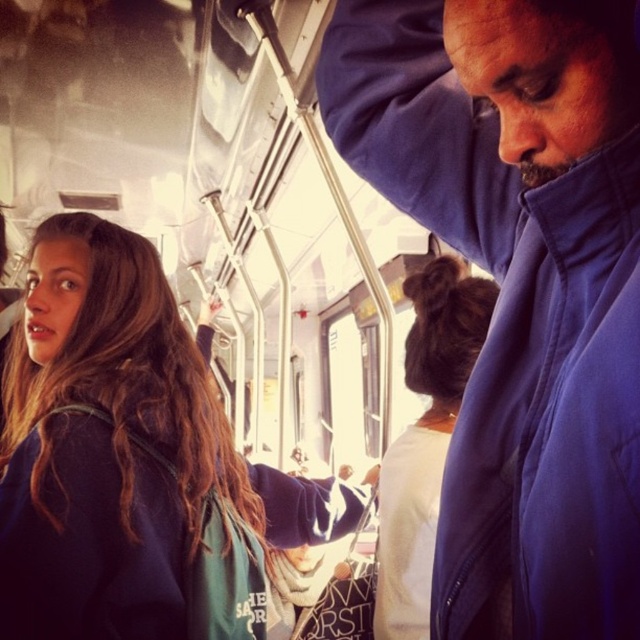
Question: Which point is closer to the camera?

Choices:
 (A) brown fuzzy hair at upper center
 (B) blue fleece jacket at upper right
 (C) brown hair at upper left

Answer: (B)

Question: Based on their relative distances, which object is nearer to the brown hair at upper left?

Choices:
 (A) brown fuzzy hair at upper center
 (B) blue fleece jacket at upper right

Answer: (A)

Question: Considering the relative positions of blue fleece jacket at upper right and brown hair at upper left in the image provided, where is blue fleece jacket at upper right located with respect to brown hair at upper left?

Choices:
 (A) below
 (B) above

Answer: (B)

Question: Can you confirm if blue fleece jacket at upper right is positioned to the left of brown hair at upper left?

Choices:
 (A) no
 (B) yes

Answer: (A)

Question: Which point appears closest to the camera in this image?

Choices:
 (A) (422, 416)
 (B) (93, 259)
 (C) (561, 236)

Answer: (C)

Question: Is brown hair at upper left to the left of brown fuzzy hair at upper center from the viewer's perspective?

Choices:
 (A) no
 (B) yes

Answer: (B)